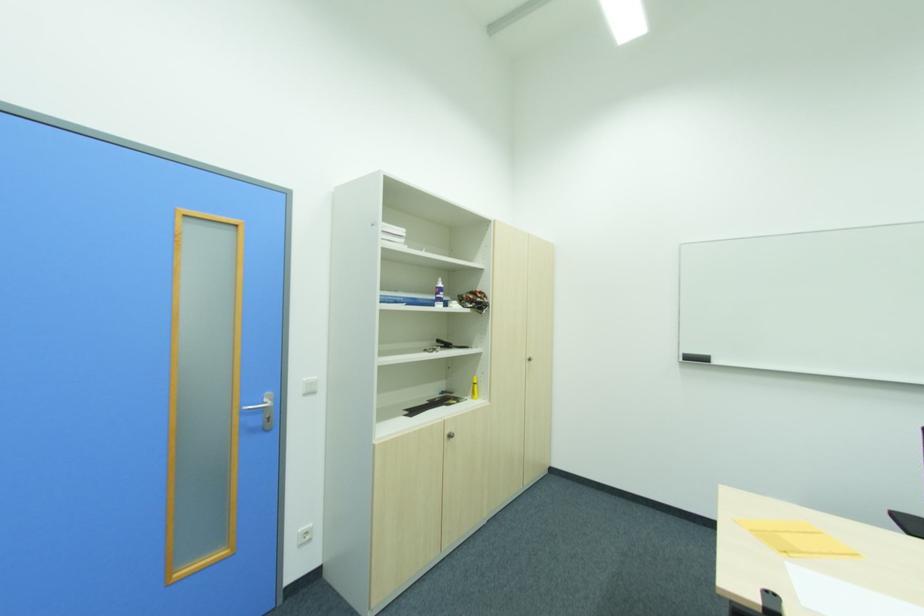
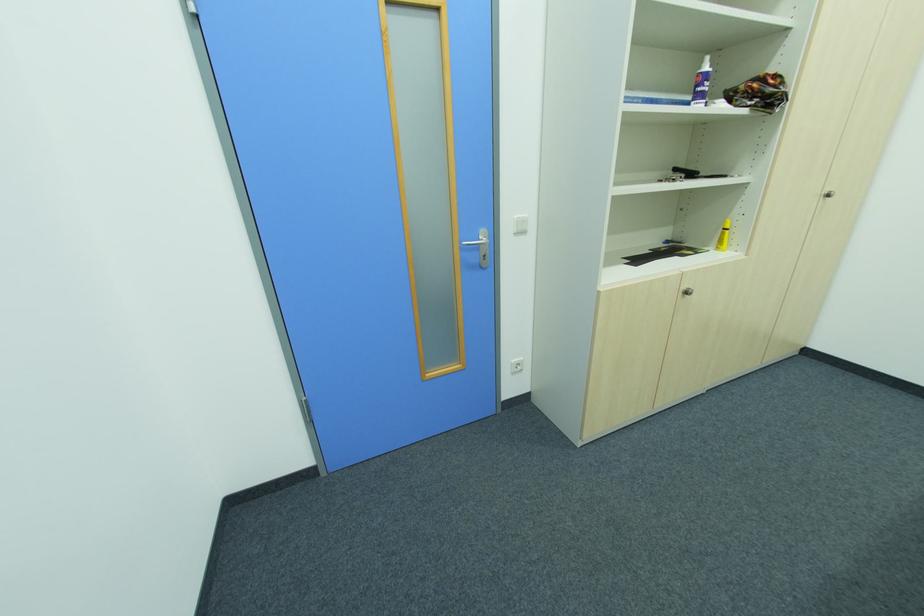
The point at (x=444, y=290) is marked in the first image. Where is the corresponding point in the second image?

(708, 78)